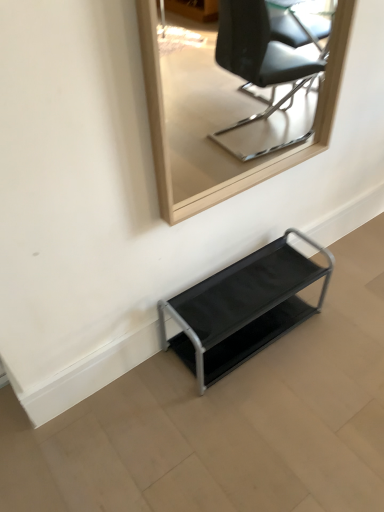
In order to click on vacant space to the right of metallic gray shelf at lower center in this screenshot , I will do `click(334, 331)`.